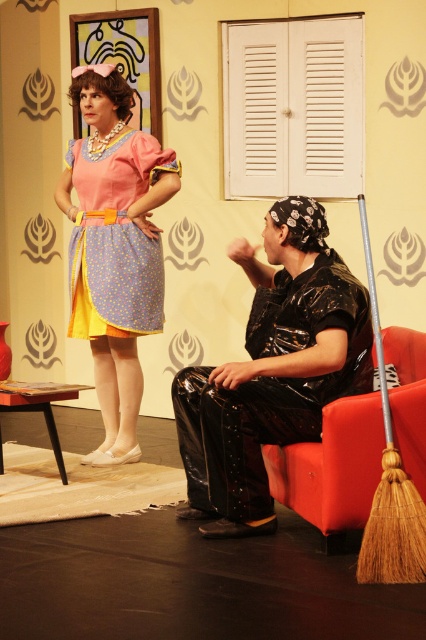
Question: Which object appears farthest from the camera in this image?

Choices:
 (A) shiny black pants at lower right
 (B) matte pink dress at upper left
 (C) rubberized black armchair at lower right

Answer: (B)

Question: Does shiny black pants at lower right appear on the left side of matte pink dress at upper left?

Choices:
 (A) yes
 (B) no

Answer: (B)

Question: Can you confirm if shiny black pants at lower right is thinner than rubberized black armchair at lower right?

Choices:
 (A) no
 (B) yes

Answer: (A)

Question: Which object appears farthest from the camera in this image?

Choices:
 (A) shiny black pants at lower right
 (B) matte pink dress at upper left
 (C) rubberized black armchair at lower right
 (D) matte pink fabric dress at upper left

Answer: (D)

Question: Does matte pink dress at upper left appear on the right side of matte pink fabric dress at upper left?

Choices:
 (A) yes
 (B) no

Answer: (B)

Question: Which object appears farthest from the camera in this image?

Choices:
 (A) rubberized black armchair at lower right
 (B) shiny black pants at lower right
 (C) matte pink fabric dress at upper left
 (D) matte pink dress at upper left

Answer: (C)